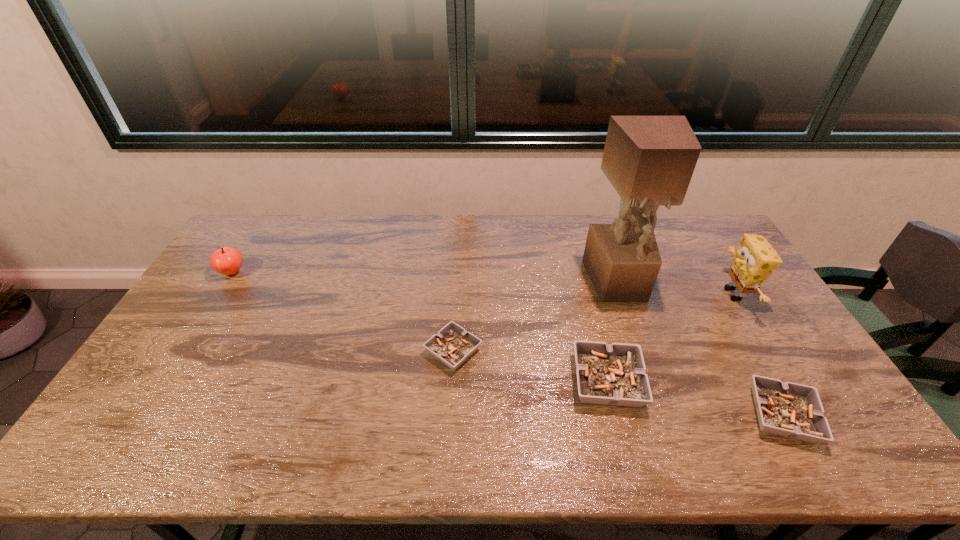
Locate an element on the screen. free space for a new ashtray on the left is located at coordinates (317, 324).